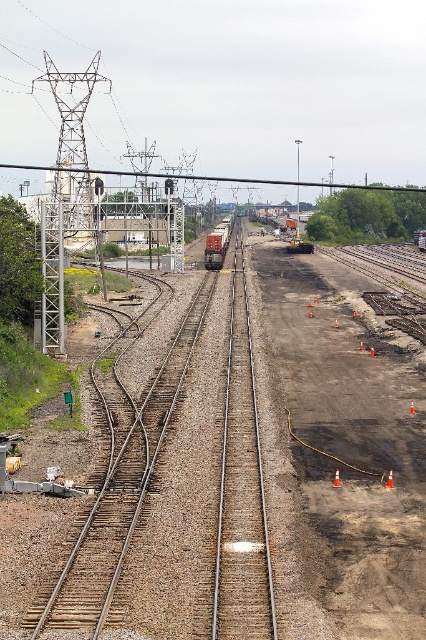
Question: Which of the following is the closest to the observer?

Choices:
 (A) (253, 557)
 (B) (206, 177)
 (C) (215, 243)

Answer: (A)

Question: Which point appears farthest from the camera in this image?

Choices:
 (A) (339, 468)
 (B) (409, 406)
 (C) (284, 352)

Answer: (C)

Question: Does smooth steel train track at center have a larger size compared to orange traffic cone at center?

Choices:
 (A) yes
 (B) no

Answer: (A)

Question: Is brown gravel dirt track at center to the right of orange traffic cone at center from the viewer's perspective?

Choices:
 (A) no
 (B) yes

Answer: (A)

Question: Which point appears closest to the camera in this image?

Choices:
 (A) (207, 244)
 (B) (158, 173)
 (C) (336, 481)
 (D) (391, 484)

Answer: (D)

Question: Does smooth steel train track at center have a larger size compared to orange plastic traffic cone at center-right?

Choices:
 (A) no
 (B) yes

Answer: (B)